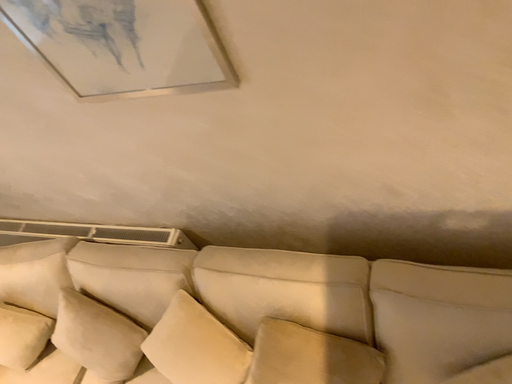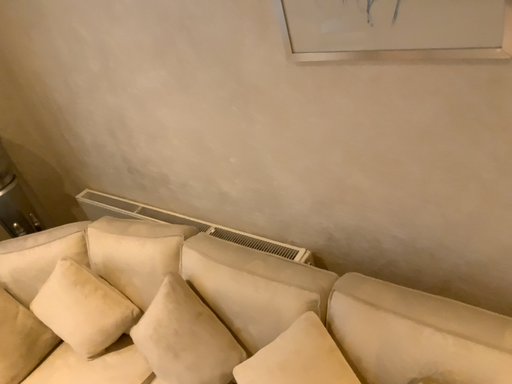
Question: How did the camera likely rotate when shooting the video?

Choices:
 (A) rotated upward
 (B) rotated downward

Answer: (A)